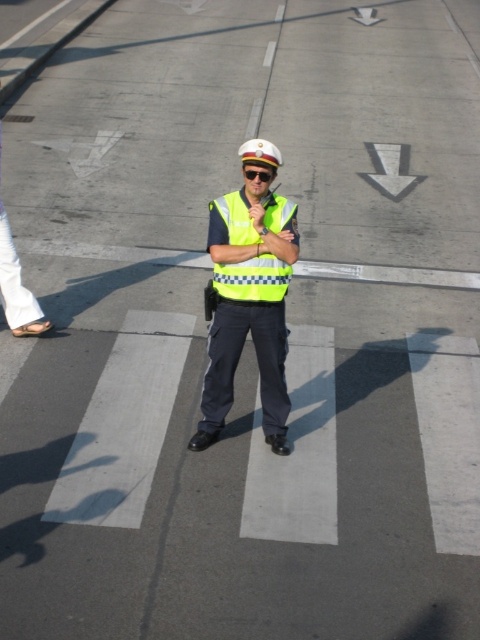
You are a delivery driver approaching the pedestrian crossing where the traffic officer is standing. You notice two points marked on the road ahead. The first point is at coordinates point (x=213, y=365) and the second is at point (x=238, y=272). According to the officer, you must stop before reaching the point that is further back. Which point should you stop before?

You should stop before reaching point (x=213, y=365) because it is behind point (x=238, y=272), making it the further back point.

In the scene shown: You are a delivery driver who needs to pass through the pedestrian crossing where the reflective yellow vest at center is located. The road has a 3.5 meters minimum passing distance requirement. Can you safely pass through without violating the distance rule?

The reflective yellow vest at center is 4.29 meters apart, which is greater than the 3.5 meters minimum passing distance requirement, so you can safely pass through without violating the distance rule.

You are a pedestrian standing at the edge of the road and see the traffic officer at point (214, 355). You need to cross the road to reach a store located directly across from your current position. The store is 10 meters away from you. Can you safely cross the road without passing the traffic officer? Explain your reasoning.

The point where the traffic officer is standing is 4.66 meters away from you. Since the store is 10 meters away across the road, you can safely cross the road while maintaining a distance from the traffic officer as long as you follow the pedestrian crossing and stay within the marked lanes.